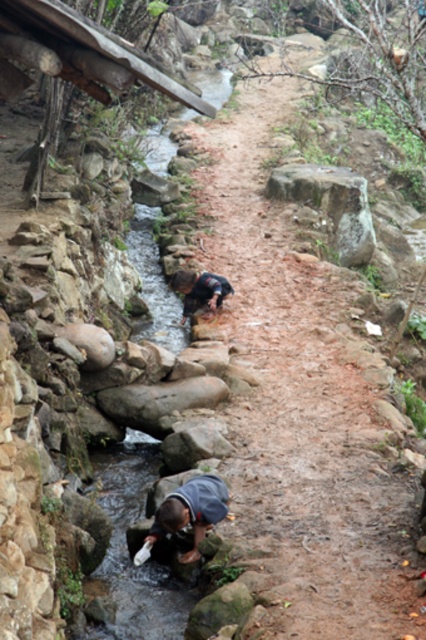
Looking at this image, is gray rough rock at upper center taller than gray fabric at lower center?

Correct, gray rough rock at upper center is much taller as gray fabric at lower center.

Which is above, gray rough rock at upper center or gray fabric at lower center?

gray rough rock at upper center is above.

Which is in front, point (299, 168) or point (186, 522)?

Point (186, 522) is more forward.

This screenshot has width=426, height=640. Find the location of `gray rough rock at upper center`. gray rough rock at upper center is located at coordinates (331, 205).

Based on the photo, between gray fabric at lower center and dark blue fabric at center, which one has more height?

With more height is dark blue fabric at center.

At what (x,y) coordinates should I click in order to perform the action: click on gray fabric at lower center. Please return your answer as a coordinate pair (x, y). Looking at the image, I should click on (190, 512).

Between point (351, 252) and point (206, 307), which one is positioned in front?

Point (206, 307) is in front.

Which is behind, point (325, 177) or point (219, 284)?

Positioned behind is point (325, 177).

Identify the location of gray rough rock at upper center. (331, 205).